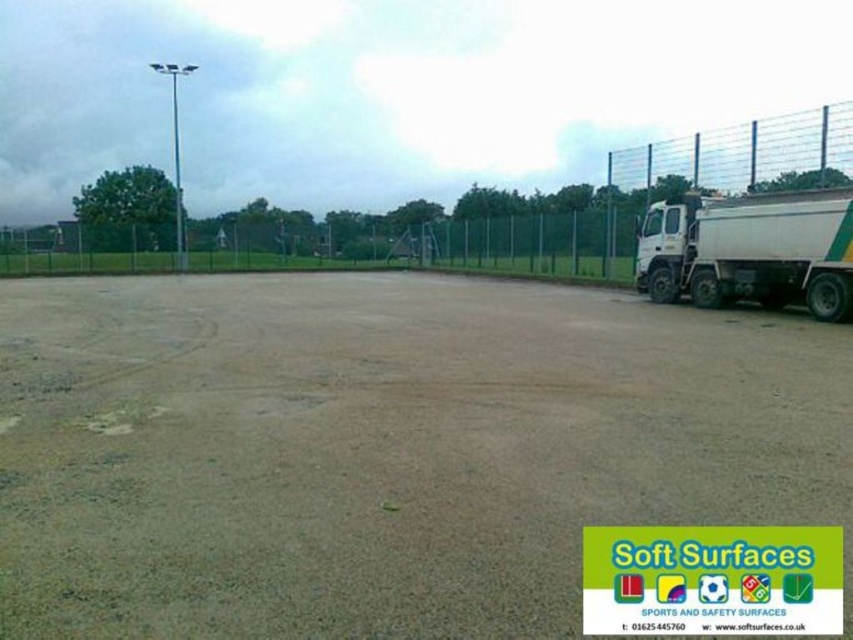
Question: Can you confirm if brown gravel dirt field at center is wider than metal mesh fence at upper right?

Choices:
 (A) no
 (B) yes

Answer: (A)

Question: Which point is farther from the camera taking this photo?

Choices:
 (A) (813, 225)
 (B) (341, 428)
 (C) (633, 172)

Answer: (C)

Question: In this image, where is brown gravel dirt field at center located relative to metal mesh fence at upper right?

Choices:
 (A) right
 (B) left

Answer: (B)

Question: Is brown gravel dirt field at center wider than white matte truck at right?

Choices:
 (A) no
 (B) yes

Answer: (B)

Question: Which point is closer to the camera?

Choices:
 (A) pos(187,388)
 (B) pos(624,164)

Answer: (A)

Question: Which point is farther to the camera?

Choices:
 (A) brown gravel dirt field at center
 (B) metal mesh fence at upper right

Answer: (B)